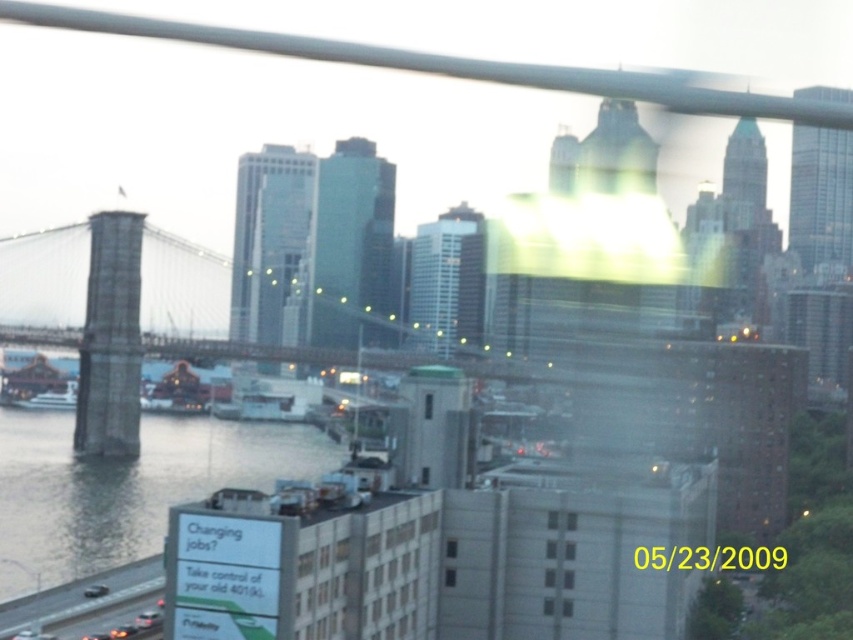
You are a photographer trying to capture the Brooklyn Bridge at dusk. You notice the clear water at lower left and the white matte boat at left in your frame. Which object should you focus on if you want to emphasize the larger element in the scene?

The clear water at lower left should be focused on because it has a larger size compared to the white matte boat at left.

You are a photographer trying to capture the Brooklyn Bridge at dusk. You notice the clear water at lower left and the concrete bridge at center. Which object appears taller in the photo?

The clear water at lower left appears much taller than the concrete bridge at center in the photo.